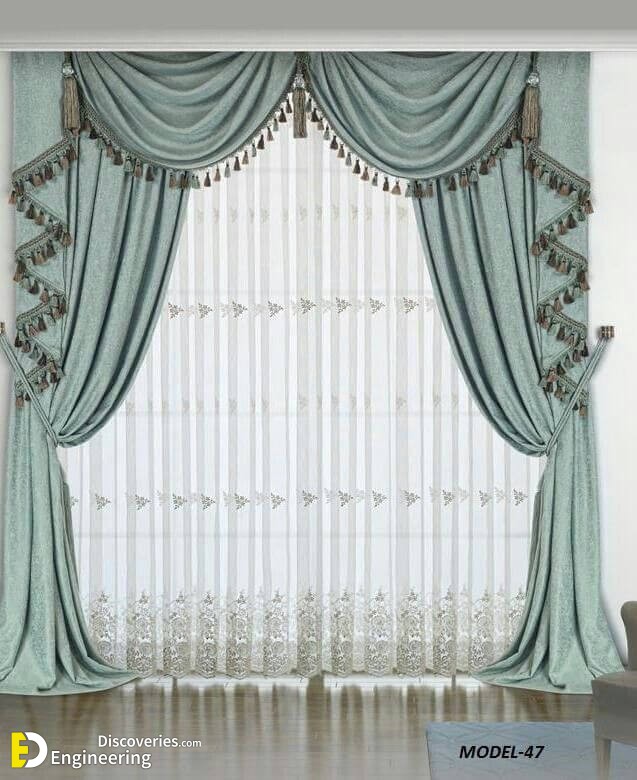
Locate an element on the screen. The image size is (637, 780). chair is located at coordinates (619, 697).